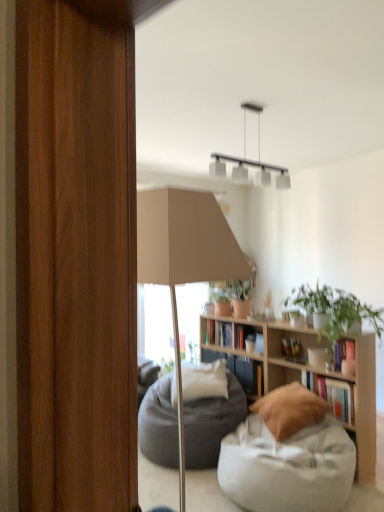
Question: Can you confirm if wooden bookshelf at center is smaller than hardcover book at center, which ranks as the 2th book in front-to-back order?

Choices:
 (A) yes
 (B) no

Answer: (B)

Question: Can you see wooden bookshelf at center touching hardcover book at center, the second book when ordered from right to left?

Choices:
 (A) yes
 (B) no

Answer: (B)

Question: Is hardcover book at center, the second book when ordered from right to left, a part of wooden bookshelf at center?

Choices:
 (A) no
 (B) yes

Answer: (B)

Question: Does wooden bookshelf at center have a greater width compared to hardcover book at center, the second book when ordered from right to left?

Choices:
 (A) yes
 (B) no

Answer: (A)

Question: Is wooden bookshelf at center to the left of hardcover book at center, the second book when ordered from right to left, from the viewer's perspective?

Choices:
 (A) yes
 (B) no

Answer: (B)

Question: Is wooden bookshelf at center outside of hardcover book at center, which appears as the second book when viewed from the back?

Choices:
 (A) yes
 (B) no

Answer: (A)

Question: Is the position of green matte plant at upper right more distant than that of white matte pendant light at upper center?

Choices:
 (A) yes
 (B) no

Answer: (A)

Question: Considering the relative sizes of green matte plant at upper right and white matte pendant light at upper center in the image provided, is green matte plant at upper right shorter than white matte pendant light at upper center?

Choices:
 (A) yes
 (B) no

Answer: (A)

Question: From the image's perspective, is green matte plant at upper right under white matte pendant light at upper center?

Choices:
 (A) no
 (B) yes

Answer: (B)

Question: Is green matte plant at upper right aimed at white matte pendant light at upper center?

Choices:
 (A) no
 (B) yes

Answer: (A)

Question: From a real-world perspective, does green matte plant at upper right sit lower than white matte pendant light at upper center?

Choices:
 (A) yes
 (B) no

Answer: (A)

Question: Is green matte plant at upper right positioned beyond the bounds of white matte pendant light at upper center?

Choices:
 (A) yes
 (B) no

Answer: (A)

Question: Is hardcover book at center, the 3th book from the right, oriented towards white fabric bean bag at lower right?

Choices:
 (A) no
 (B) yes

Answer: (A)